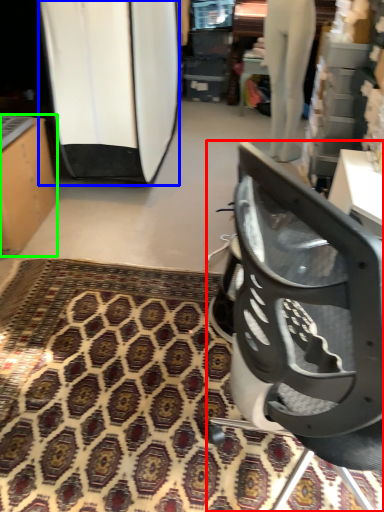
Question: Which object is positioned farthest from chair (highlighted by a red box)? Select from surfboard (highlighted by a blue box) and furniture (highlighted by a green box).

Choices:
 (A) surfboard
 (B) furniture

Answer: (A)